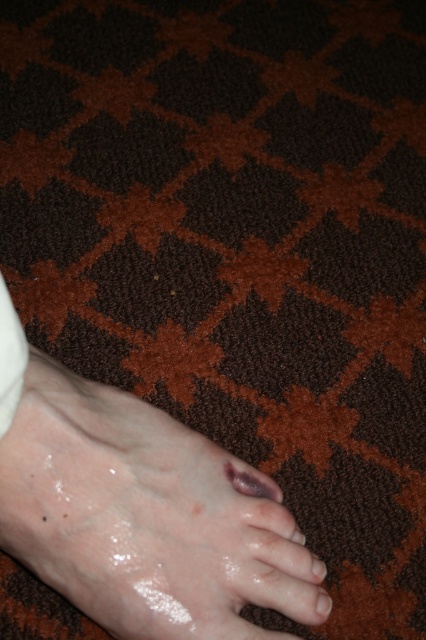
Looking at this image, you are a medical professional examining the foot in the image. You notice two toes at the lower center. Which toe is taller between the purple matte toe at lower center and the matte brown toe at lower center?

The purple matte toe at lower center is taller than the matte brown toe at lower center according to the description.

You are a medical professional assessing the scene. You notice the slick skin foot at lower center and the glossy pink toe at lower left. Which object is positioned to the right side?

The slick skin foot at lower center is positioned to the right of the glossy pink toe at lower left.

You are a first responder assessing the scene. The slick skin foot at lower center and glossy pink toe at lower left are both visible. Which object is positioned higher in the image?

The slick skin foot at lower center is positioned higher in the image than the glossy pink toe at lower left.